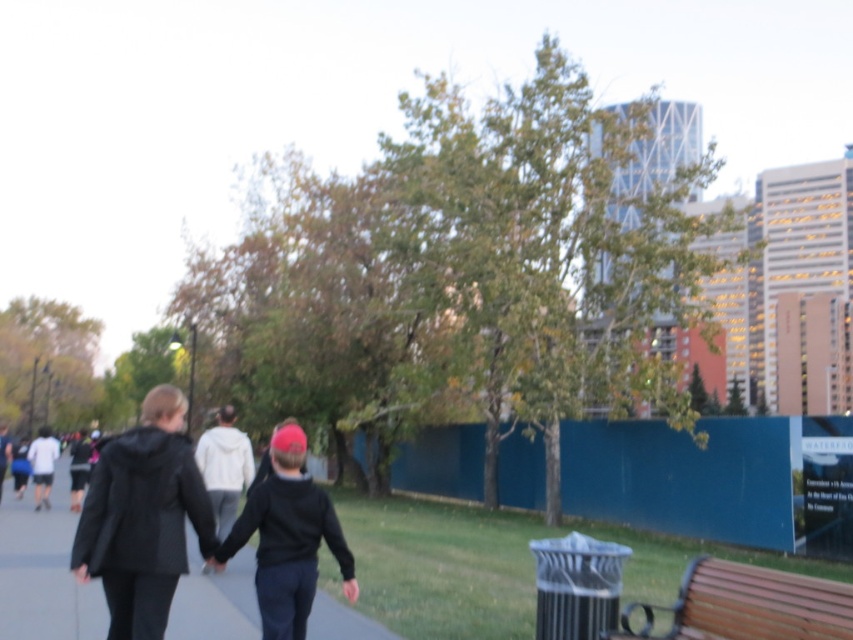
Does black hoodie at center have a greater height compared to black matte jacket at center?

Correct, black hoodie at center is much taller as black matte jacket at center.

Looking at this image, measure the distance between black hoodie at center and black matte jacket at center.

black hoodie at center is 79.05 centimeters from black matte jacket at center.

Where is `black hoodie at center`? This screenshot has height=640, width=853. black hoodie at center is located at coordinates (143, 516).

Based on the photo, does black hoodie at center come behind white matte shirt at left?

That is False.

Can you confirm if black hoodie at center is taller than white matte shirt at left?

No.

Is point (79, 525) closer to camera compared to point (38, 465)?

Yes, point (79, 525) is in front of point (38, 465).

The width and height of the screenshot is (853, 640). I want to click on black hoodie at center, so click(x=143, y=516).

Which of these two, white matte shirt at left or dark gray hoodie at center, stands shorter?

With less height is dark gray hoodie at center.

Who is higher up, white matte shirt at left or dark gray hoodie at center?

Positioned higher is dark gray hoodie at center.

What do you see at coordinates (42, 465) in the screenshot?
I see `white matte shirt at left` at bounding box center [42, 465].

Find the location of `white matte shirt at left`. white matte shirt at left is located at coordinates (42, 465).